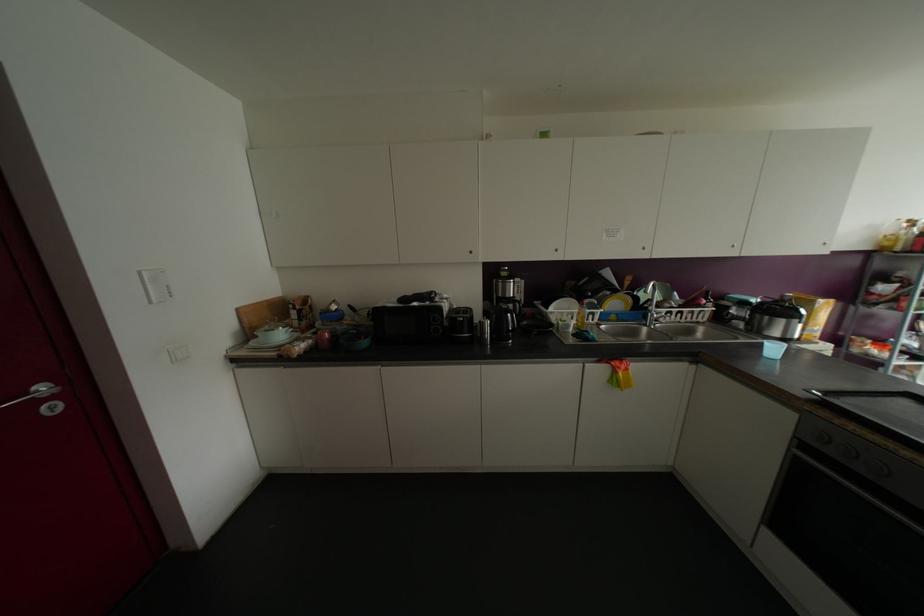
Where is `white light switch`? The image size is (924, 616). white light switch is located at coordinates (155, 285).